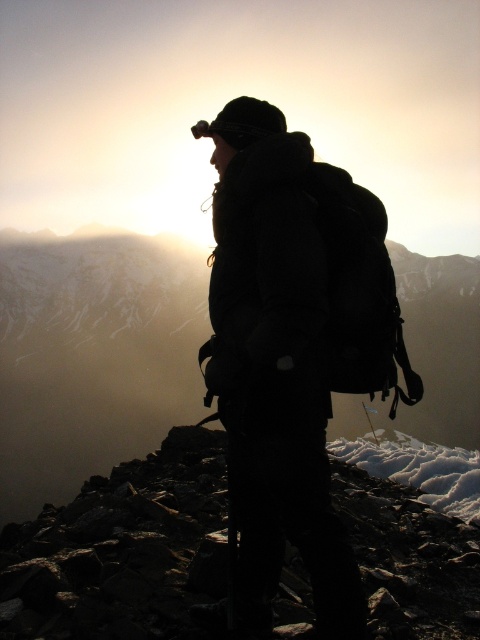
Is smooth rock at center below rough stone at center?

Actually, smooth rock at center is above rough stone at center.

Based on the photo, measure the distance between point (x=12, y=348) and camera.

Point (x=12, y=348) and camera are 144.31 meters apart from each other.

Locate an element on the screen. This screenshot has width=480, height=640. smooth rock at center is located at coordinates (93, 355).